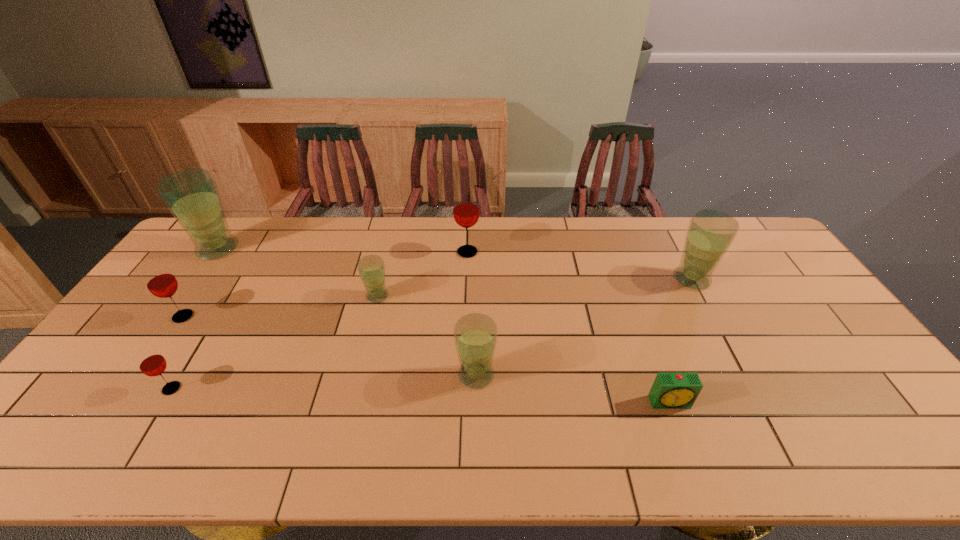
Locate which object is the closest to the tallest glass. Please provide its 2D coordinates. Your answer should be formatted as a tuple, i.e. [(x, y)], where the tuple contains the x and y coordinates of a point satisfying the conditions above.

[(160, 281)]

I want to click on the third closest object to the green alarm clock, so click(466, 211).

This screenshot has height=540, width=960. I want to click on the third closest glass to the second blue glass from right to left, so click(x=710, y=233).

Where is `glass that is the third nearest to the biggest red glass`? glass that is the third nearest to the biggest red glass is located at coordinates (710, 233).

This screenshot has height=540, width=960. I want to click on the second closest blue glass to the farthest red glass, so click(x=475, y=335).

Identify the location of blue glass object that ranks as the third closest to the rightmost red glass. click(x=710, y=233).

Locate an element on the screen. The width and height of the screenshot is (960, 540). red glass that stands as the closest to the biggest red glass is located at coordinates (160, 281).

Point out which red glass is positioned as the second nearest to the nearest red glass. Please provide its 2D coordinates. Your answer should be formatted as a tuple, i.e. [(x, y)], where the tuple contains the x and y coordinates of a point satisfying the conditions above.

[(466, 211)]

Find the location of a particular element. The width and height of the screenshot is (960, 540). free space in the image that satisfies the following two spatial constraints: 1. on the back side of the leftmost red glass; 2. on the right side of the rightmost object is located at coordinates (208, 279).

You are a GUI agent. You are given a task and a screenshot of the screen. Output one action in this format:
    pyautogui.click(x=<x>, y=<y>)
    Task: Click on the free space that satisfies the following two spatial constraints: 1. on the front side of the third blue glass from left to right; 2. on the left side of the leftmost blue glass
    The image size is (960, 540).
    Given the screenshot: What is the action you would take?
    pyautogui.click(x=129, y=375)